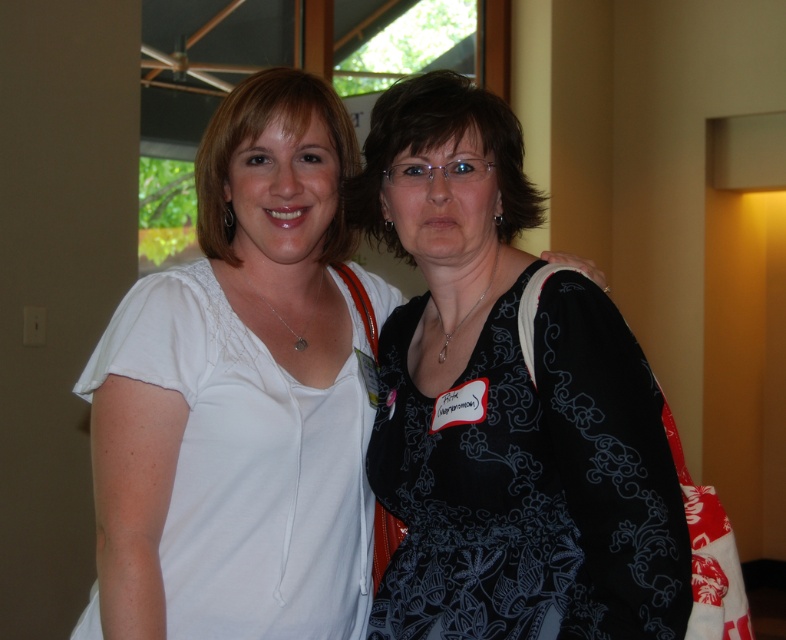
Question: From the image, what is the correct spatial relationship of black printed dress at center in relation to white matte shirt at left?

Choices:
 (A) left
 (B) right

Answer: (B)

Question: Among these objects, which one is farthest from the camera?

Choices:
 (A) white matte shirt at left
 (B) black printed dress at center

Answer: (A)

Question: Does black printed dress at center have a smaller size compared to white matte shirt at left?

Choices:
 (A) yes
 (B) no

Answer: (A)

Question: Can you confirm if black printed dress at center is smaller than white matte shirt at left?

Choices:
 (A) yes
 (B) no

Answer: (A)